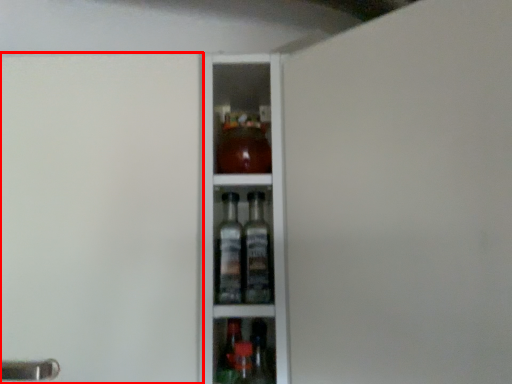
Question: Observing the image, what is the correct spatial positioning of screen door (annotated by the red box) in reference to screen door?

Choices:
 (A) right
 (B) left

Answer: (B)